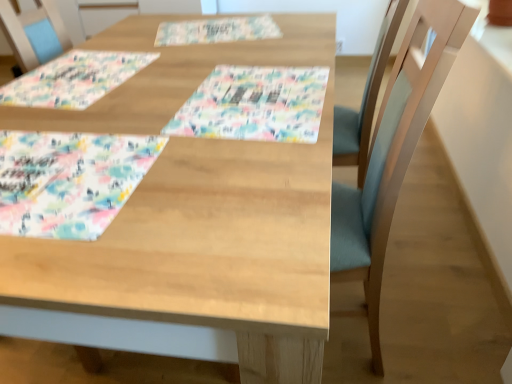
This screenshot has width=512, height=384. What are the coordinates of `blank area beneath pastel floral fabric placemat at lower left, the 3th place mat from the top (from a real-world perspective)` in the screenshot? It's located at (57, 174).